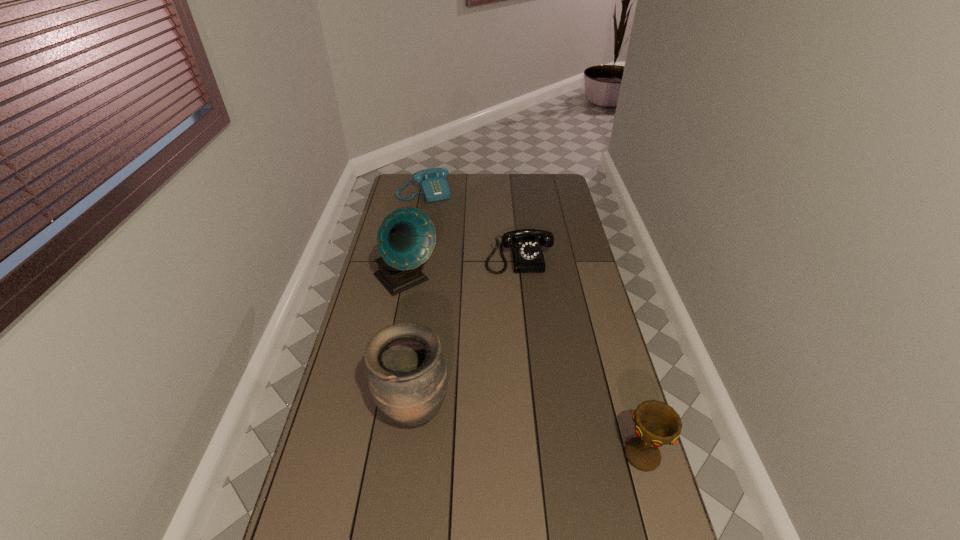
Where is `free location that satisfies the following two spatial constraints: 1. on the front side of the urn; 2. on the right side of the tallest object`? The width and height of the screenshot is (960, 540). free location that satisfies the following two spatial constraints: 1. on the front side of the urn; 2. on the right side of the tallest object is located at coordinates (380, 414).

The height and width of the screenshot is (540, 960). What are the coordinates of `free space that satisfies the following two spatial constraints: 1. on the front side of the third shortest object; 2. on the left side of the second tallest object` in the screenshot? It's located at (410, 455).